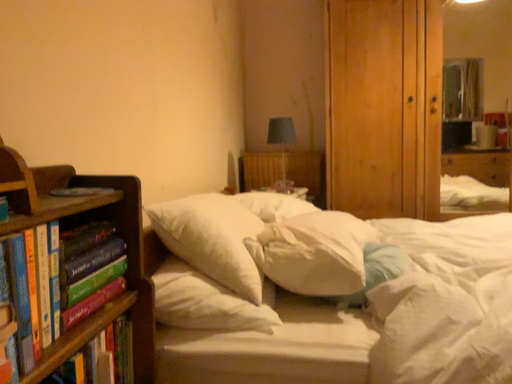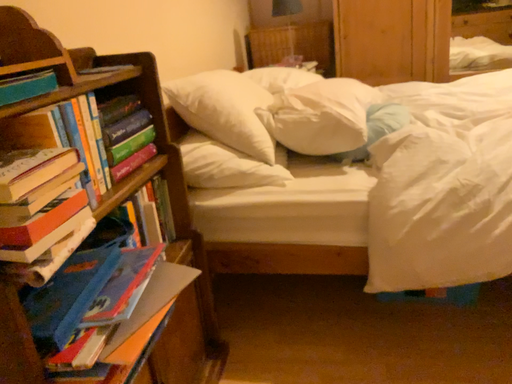
Question: Which way did the camera rotate in the video?

Choices:
 (A) rotated downward
 (B) rotated upward

Answer: (A)